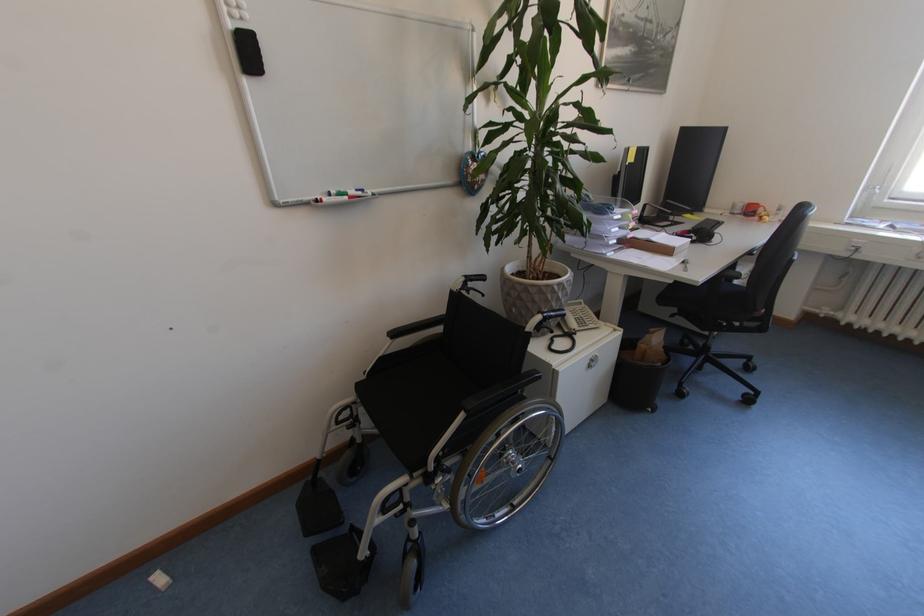
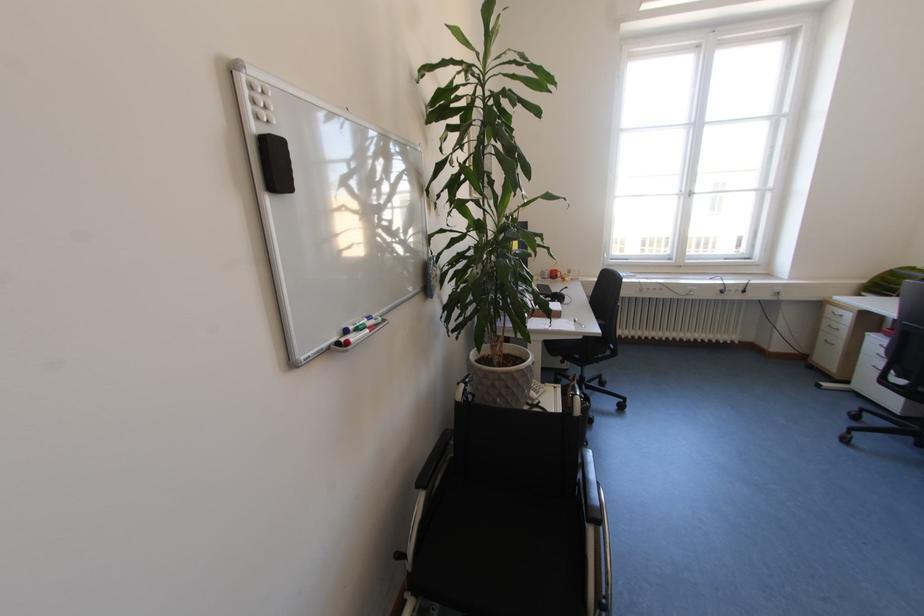
Locate, in the second image, the point that corresponds to pixel 347 196 in the first image.

(366, 330)